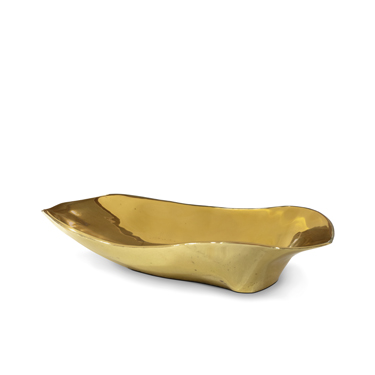
Locate an element on the screen. gold dish is located at coordinates (210, 221).